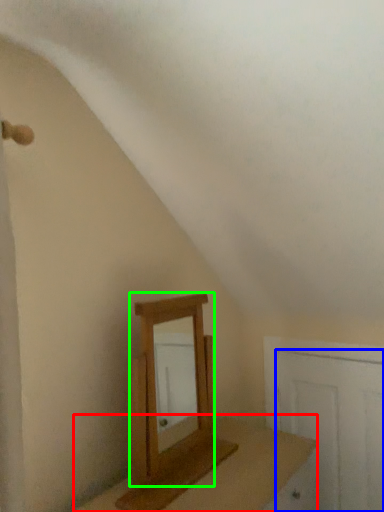
Question: Which is nearer to the table (highlighted by a red box)? door (highlighted by a blue box) or mirror (highlighted by a green box).

Choices:
 (A) door
 (B) mirror

Answer: (B)